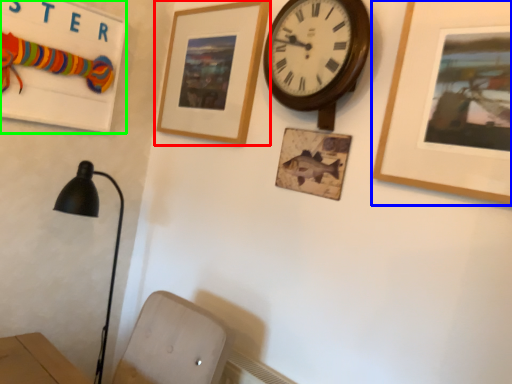
Question: Considering the real-world distances, which object is closest to picture frame (highlighted by a red box)? picture frame (highlighted by a blue box) or bulletin board (highlighted by a green box).

Choices:
 (A) picture frame
 (B) bulletin board

Answer: (B)